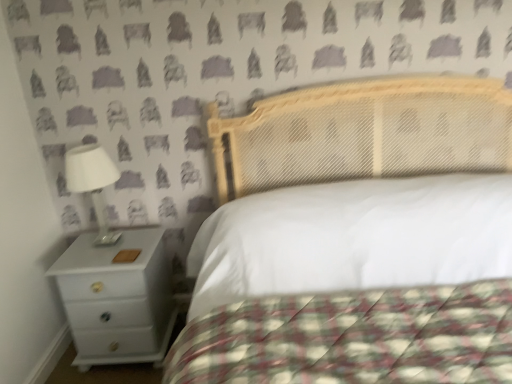
I want to click on vacant space in front of white glossy lamp at left, so click(95, 256).